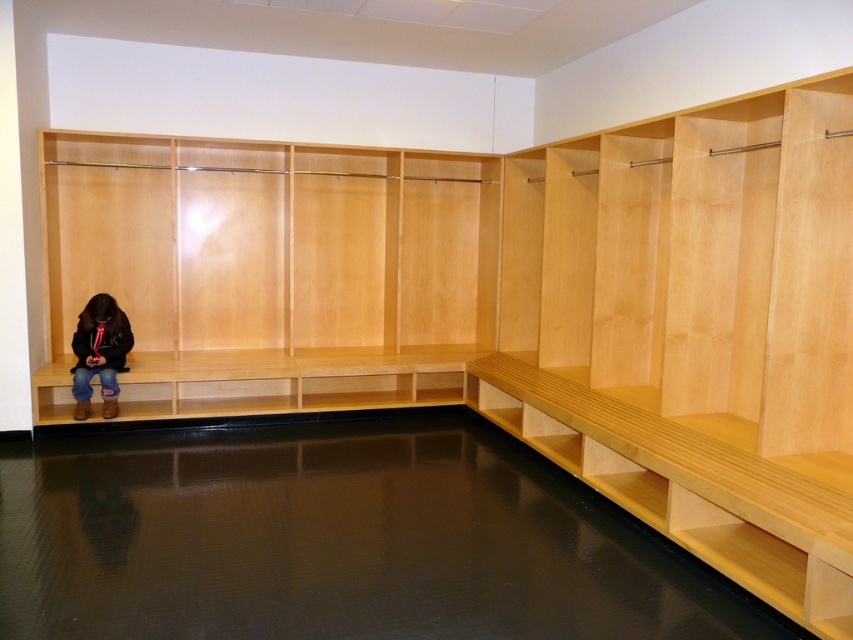
Question: Among these points, which one is farthest from the camera?

Choices:
 (A) (107, 328)
 (B) (149, 259)

Answer: (B)

Question: Is light wood bench at left in front of dark brown leather boots at lower left?

Choices:
 (A) no
 (B) yes

Answer: (A)

Question: Which of the following is the closest to the observer?

Choices:
 (A) light wood bench at left
 (B) dark brown leather boots at lower left

Answer: (B)

Question: Is light wood bench at left thinner than dark brown leather boots at lower left?

Choices:
 (A) no
 (B) yes

Answer: (A)

Question: Can you confirm if light wood bench at left is positioned to the left of dark brown leather boots at lower left?

Choices:
 (A) yes
 (B) no

Answer: (B)